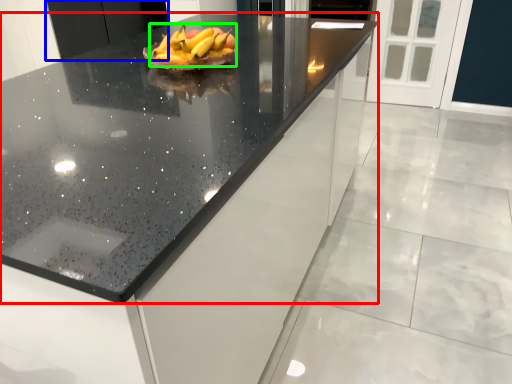
Question: Estimate the real-world distances between objects in this image. Which object is farther from countertop (highlighted by a red box), cabinetry (highlighted by a blue box) or grapefruit (highlighted by a green box)?

Choices:
 (A) cabinetry
 (B) grapefruit

Answer: (A)